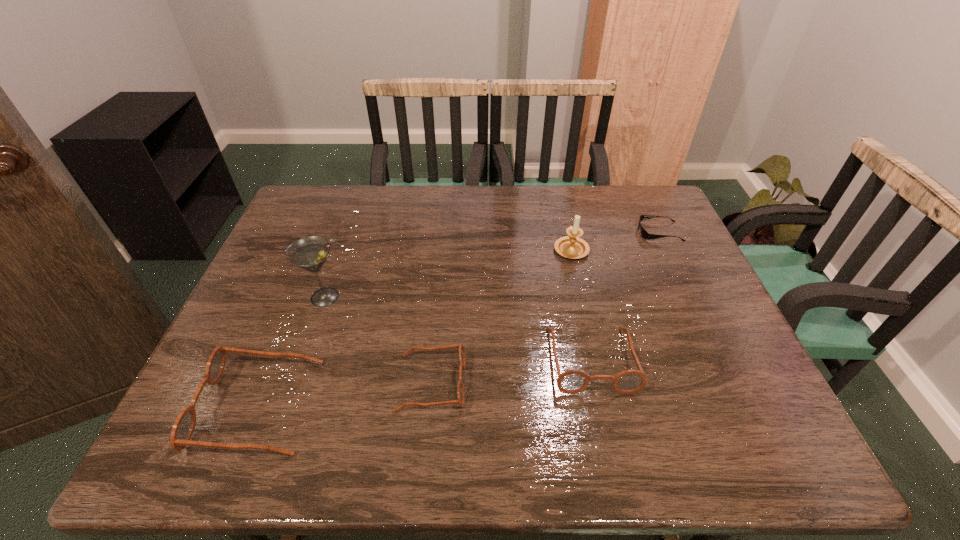
Where is `the tallest spectacles`? the tallest spectacles is located at coordinates (183, 428).

At what (x,y) coordinates should I click in order to perform the action: click on the fourth shortest object. Please return your answer as a coordinate pair (x, y). Image resolution: width=960 pixels, height=540 pixels. Looking at the image, I should click on (183, 428).

The image size is (960, 540). I want to click on the second spectacles from left to right, so click(462, 356).

What are the coordinates of `the fifth tallest object` in the screenshot? It's located at (462, 356).

This screenshot has height=540, width=960. I want to click on the rightmost spectacles, so click(571, 381).

This screenshot has width=960, height=540. I want to click on the third shortest object, so click(x=571, y=381).

Identify the location of the fifth shortest object. The image size is (960, 540). (571, 246).

The height and width of the screenshot is (540, 960). In order to click on the tallest object in this screenshot , I will do `click(310, 253)`.

You are a GUI agent. You are given a task and a screenshot of the screen. Output one action in this format:
    pyautogui.click(x=<x>, y=<y>)
    Task: Click on the martini
    The image size is (960, 540).
    Given the screenshot: What is the action you would take?
    pyautogui.click(x=310, y=253)

In order to click on sunglasses in this screenshot , I will do `click(644, 233)`.